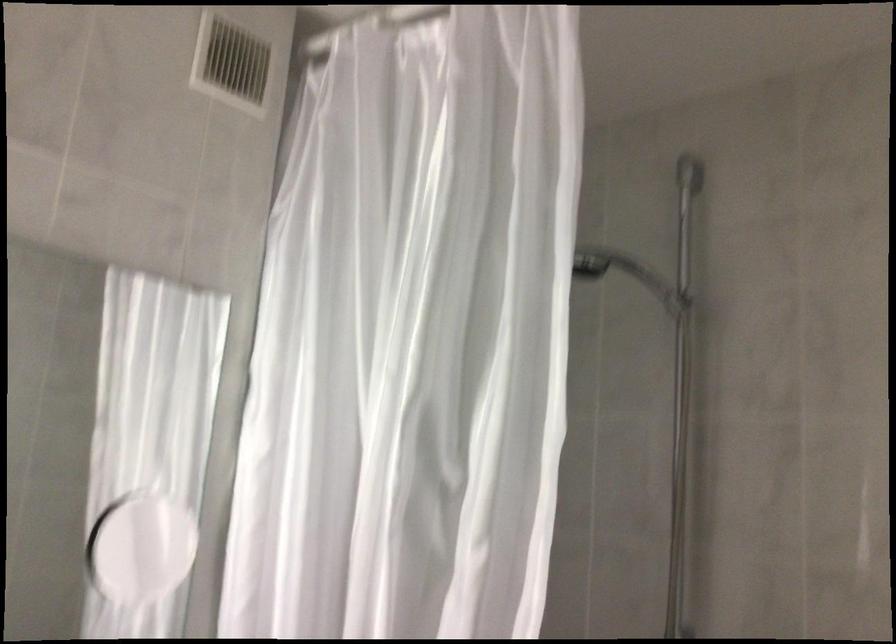
Identify the location of metal shower head. The image size is (896, 644). (590, 261).